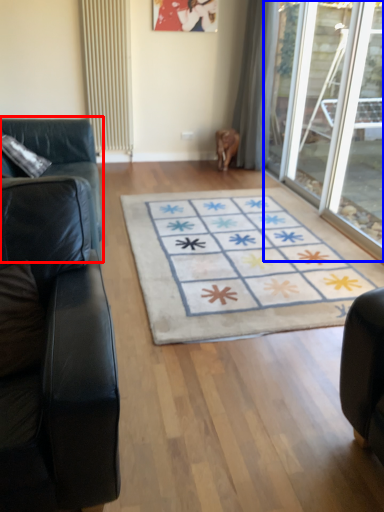
Question: Which object appears farthest to the camera in this image, studio couch (highlighted by a red box) or glass door (highlighted by a blue box)?

Choices:
 (A) studio couch
 (B) glass door

Answer: (B)